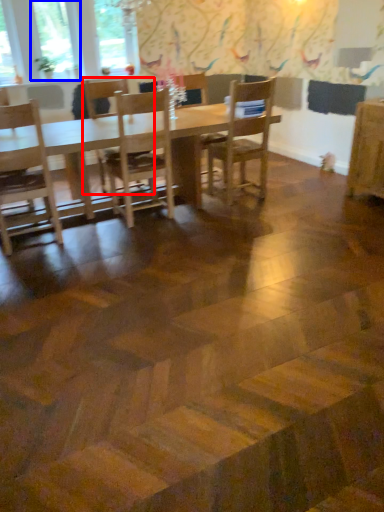
Question: Which point is closer to the camera, chair (highlighted by a red box) or window (highlighted by a blue box)?

Choices:
 (A) chair
 (B) window

Answer: (A)